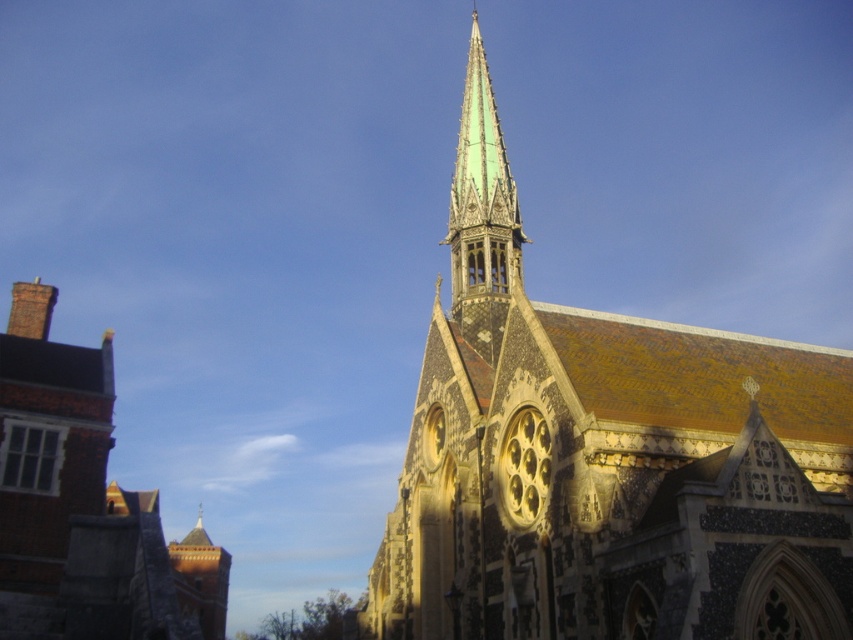
Is speckled stone church steeple at center smaller than brick chimney at left?

Yes.

Can you confirm if speckled stone church steeple at center is shorter than brick chimney at left?

Incorrect, speckled stone church steeple at center's height does not fall short of brick chimney at left's.

This screenshot has height=640, width=853. What are the coordinates of `speckled stone church steeple at center` in the screenshot? It's located at (605, 458).